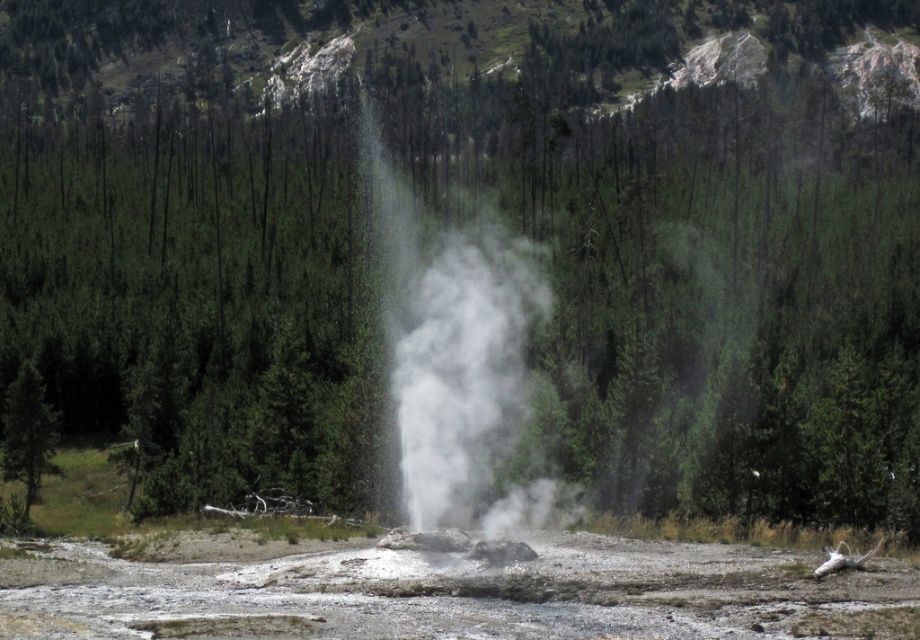
You are planning to set up a safety perimeter around the geyser to protect visitors from the erupting steam. The safety zone must be a circle with a radius of 50 feet. Given the distance between the white vapor at center and the green matte tree at left, can the tree be used as a reference point for the perimeter? Please explain.

The white vapor at center and the green matte tree at left are 76.84 feet apart. Since the safety perimeter has a radius of 50 feet, the tree is located outside the perimeter because 76.84 feet exceeds the 50 feet radius. Therefore, the tree cannot be used as a reference point within the safety zone.

You are a hiker who just arrived at the geyser area. You notice a point marked at coordinates [456,356]. What is located at that point?

At point [456,356] lies white vapor at center.